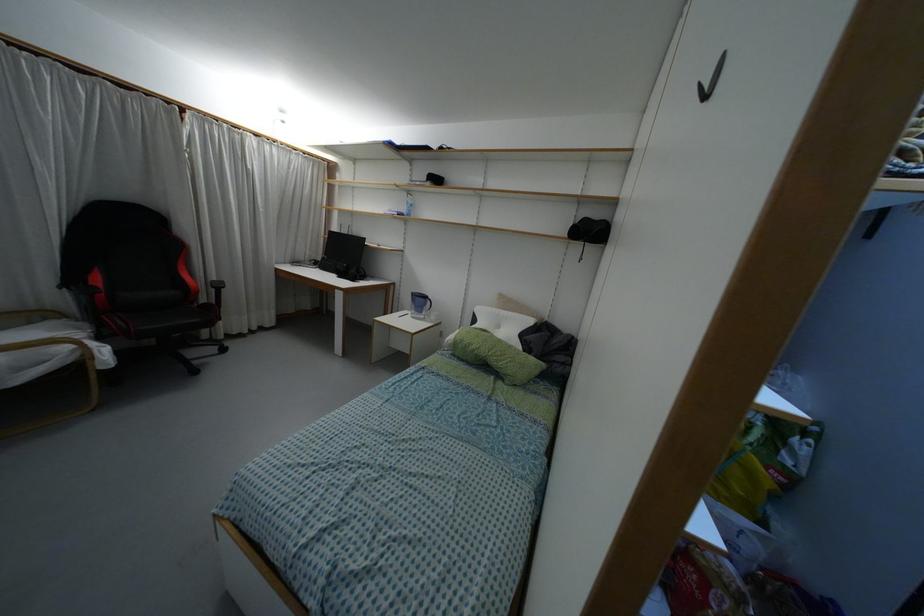
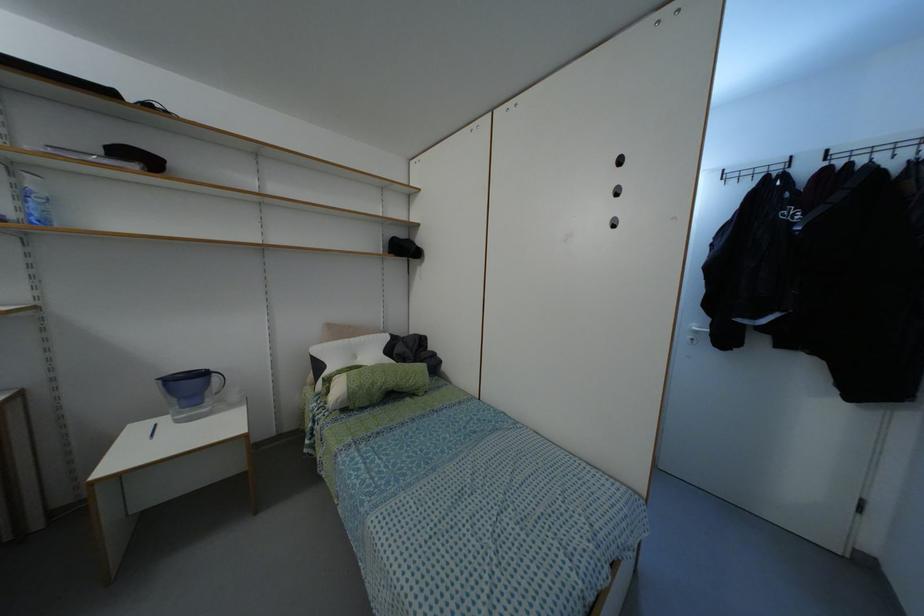
Locate, in the second image, the point that corresponds to the point at 496,310 in the first image.

(345, 339)